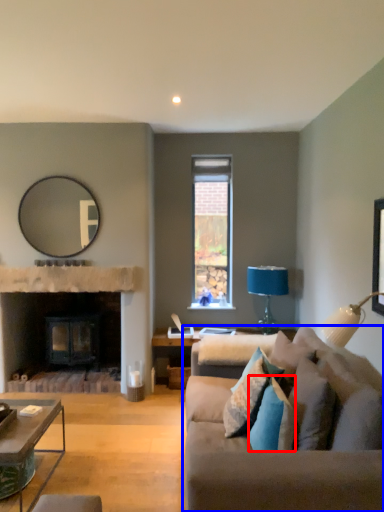
Question: Which of the following is the closest to the observer, pillow (highlighted by a red box) or studio couch (highlighted by a blue box)?

Choices:
 (A) pillow
 (B) studio couch

Answer: (B)